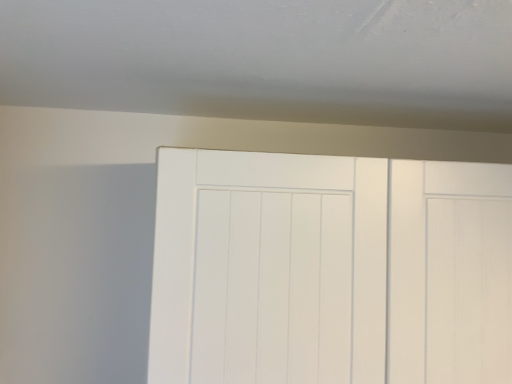
Describe the element at coordinates (329, 270) in the screenshot. I see `white matte door at center` at that location.

The image size is (512, 384). In order to click on white matte door at center in this screenshot , I will do `click(329, 270)`.

At what (x,y) coordinates should I click in order to perform the action: click on white matte door at center. Please return your answer as a coordinate pair (x, y). The height and width of the screenshot is (384, 512). Looking at the image, I should click on (329, 270).